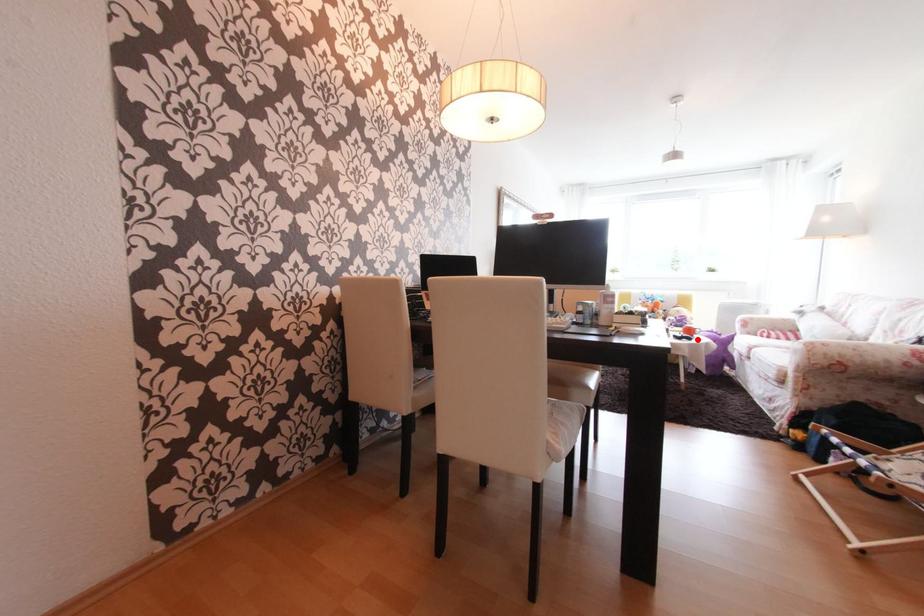
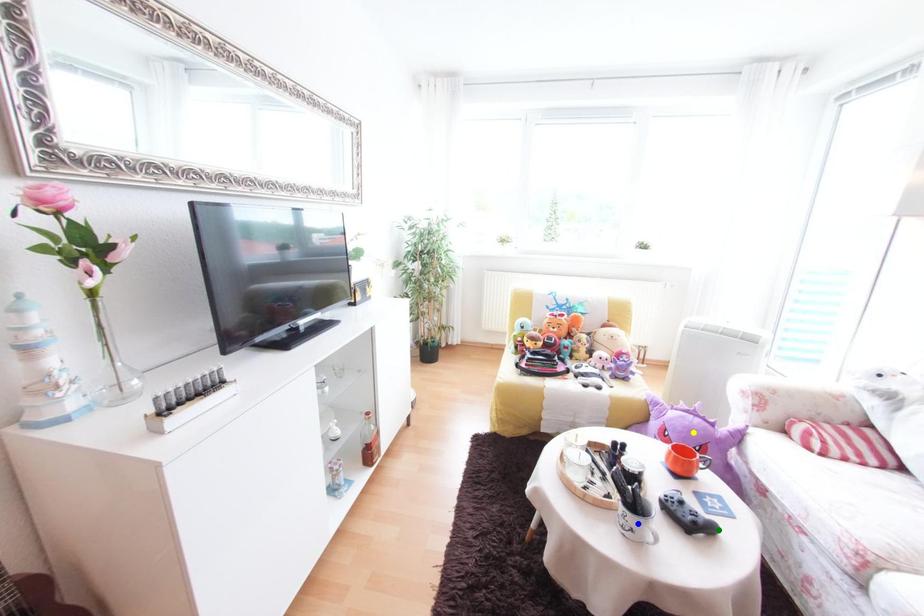
Question: I am providing you with two images of the same scene from different viewpoints. A red point is marked on the first image. You are given multiple points on the second image. Which point in image 2 represents the same 3d spot as the red point in image 1?

Choices:
 (A) green point
 (B) yellow point
 (C) blue point

Answer: (A)